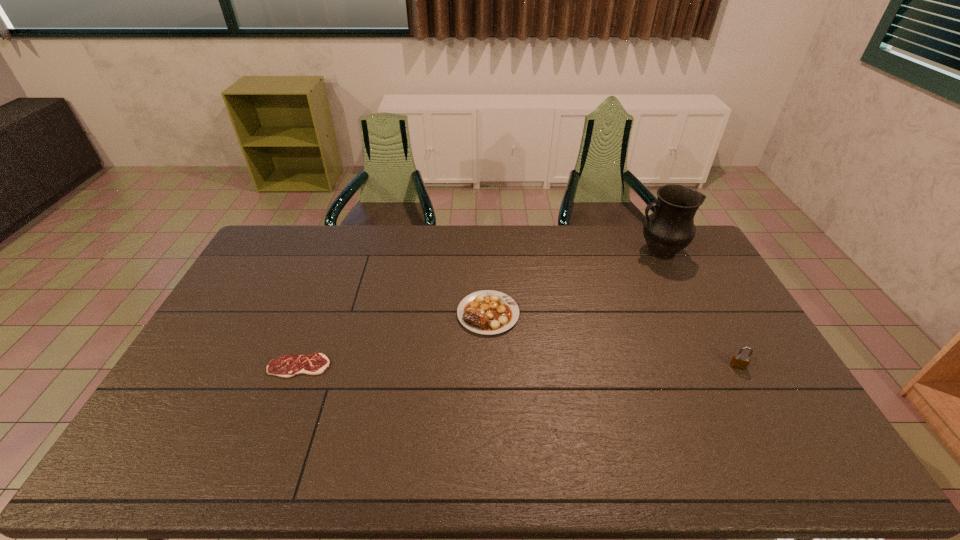
The height and width of the screenshot is (540, 960). Identify the location of the farthest object. (670, 228).

In order to click on the tallest object in this screenshot , I will do `click(670, 228)`.

Find the location of a particular element. the second tallest object is located at coordinates (739, 361).

Identify the location of the third nearest object. (488, 312).

This screenshot has height=540, width=960. In order to click on the taller steak in this screenshot , I will do `click(488, 312)`.

Where is `the nearer steak`? This screenshot has width=960, height=540. the nearer steak is located at coordinates 286,366.

Identify the location of the left steak. The width and height of the screenshot is (960, 540). (286, 366).

This screenshot has height=540, width=960. What are the coordinates of `vacant space located on the handle side of the tallest object` in the screenshot? It's located at (603, 252).

The height and width of the screenshot is (540, 960). I want to click on blank space located 0.110m on the handle side of the tallest object, so click(606, 252).

The width and height of the screenshot is (960, 540). In order to click on vacant space located 0.330m on the handle side of the tallest object in this screenshot , I will do `click(549, 252)`.